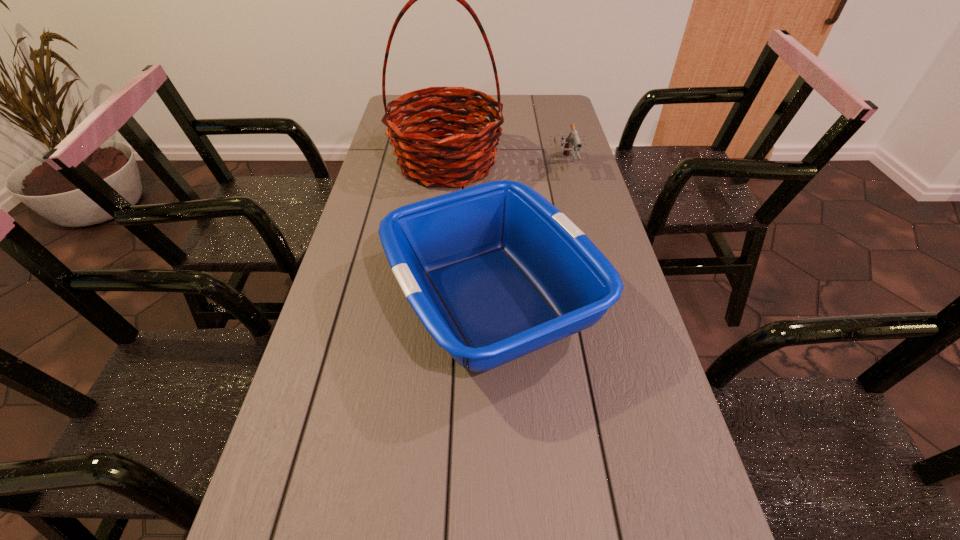
You are a GUI agent. You are given a task and a screenshot of the screen. Output one action in this format:
    pyautogui.click(x=<x>, y=<y>)
    Task: Click on the basket
    The image size is (960, 540).
    Given the screenshot: What is the action you would take?
    pyautogui.click(x=421, y=155)

Where is `tray`? Image resolution: width=960 pixels, height=540 pixels. tray is located at coordinates (494, 272).

Identify the location of the nearest object. (494, 272).

At what (x,y) coordinates should I click in order to perform the action: click on the shortest object. Please return your answer as a coordinate pair (x, y). The image size is (960, 540). Looking at the image, I should click on (573, 139).

This screenshot has width=960, height=540. Identify the location of free space located 0.360m on the back of the tallest object. (454, 95).

You are a GUI agent. You are given a task and a screenshot of the screen. Output one action in this format:
    pyautogui.click(x=<x>, y=<y>)
    Task: Click on the free space located on the front of the tray
    This screenshot has height=540, width=960.
    Given the screenshot: What is the action you would take?
    pyautogui.click(x=496, y=497)

Identify the location of vacant point located at the barrel end of the gun. This screenshot has width=960, height=540. (573, 198).

Locate an element on the screen. Image resolution: width=960 pixels, height=540 pixels. basket that is positioned at the left edge is located at coordinates (421, 155).

You are a GUI agent. You are given a task and a screenshot of the screen. Output one action in this format:
    pyautogui.click(x=<x>, y=<y>)
    Task: Click on the tray that is at the left edge
    
    Given the screenshot: What is the action you would take?
    pyautogui.click(x=494, y=272)

This screenshot has width=960, height=540. In order to click on tray present at the right edge in this screenshot , I will do `click(494, 272)`.